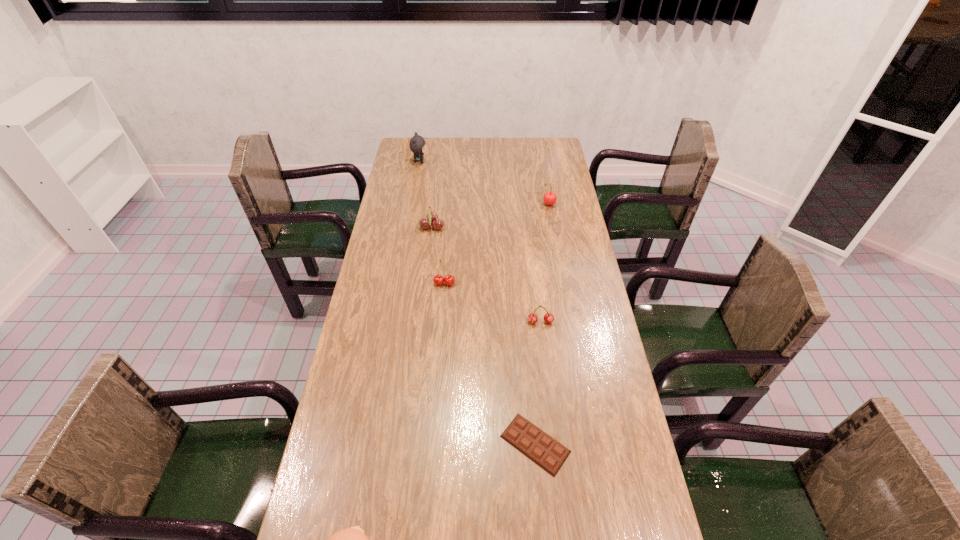
You are a GUI agent. You are given a task and a screenshot of the screen. Output one action in this format:
    pyautogui.click(x=<x>, y=<y>)
    Task: Click on the vacant position located on the front of the rightmost object
    The height and width of the screenshot is (540, 960).
    Given the screenshot: What is the action you would take?
    pyautogui.click(x=553, y=229)

What are the coordinates of `free space located with the stems of the second nearest cherry pointing upwards` in the screenshot? It's located at (439, 362).

Find the location of a particular element. vacant space located 0.100m on the leaves of the third farthest object is located at coordinates (469, 227).

This screenshot has width=960, height=540. In order to click on free space located with stems pointing upwards on the shortest cherry in this screenshot , I will do `click(551, 411)`.

Locate an element on the screen. vacant region located 0.250m on the back of the sixth farthest object is located at coordinates (526, 338).

The image size is (960, 540). In order to click on object present at the far edge in this screenshot , I will do `click(417, 144)`.

Find the location of a particular element. kitten that is positioned at the left edge is located at coordinates (417, 144).

Locate an element on the screen. This screenshot has width=960, height=540. cherry present at the left edge is located at coordinates (431, 217).

You are a GUI agent. You are given a task and a screenshot of the screen. Output one action in this format:
    pyautogui.click(x=<x>, y=<y>)
    Task: Click on the chocolate bar present at the right edge
    The height and width of the screenshot is (540, 960).
    Given the screenshot: What is the action you would take?
    pyautogui.click(x=542, y=449)

Locate an element on the screen. The width and height of the screenshot is (960, 540). object situated at the far left corner is located at coordinates pyautogui.click(x=417, y=144).